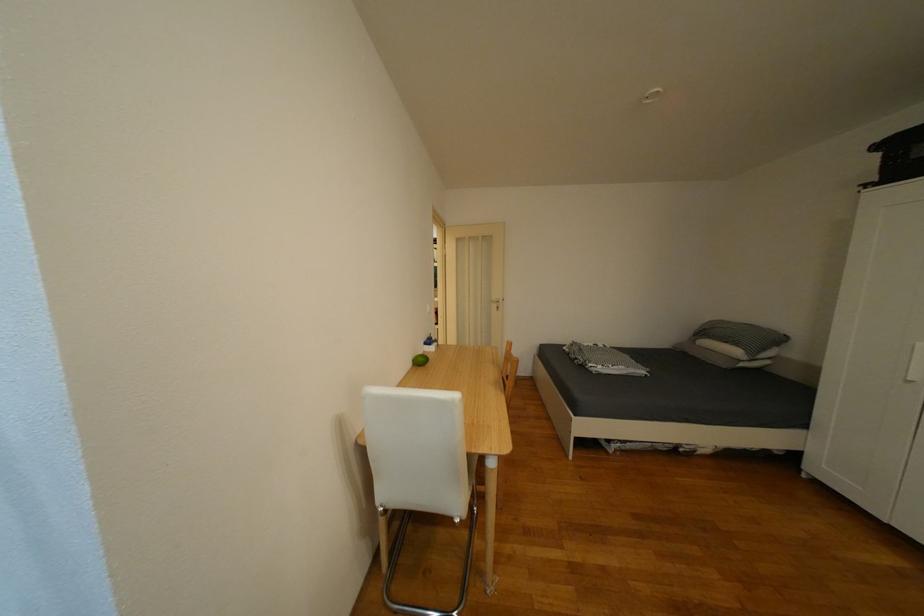
What do you see at coordinates (916, 363) in the screenshot? I see `the white wardrobe handle` at bounding box center [916, 363].